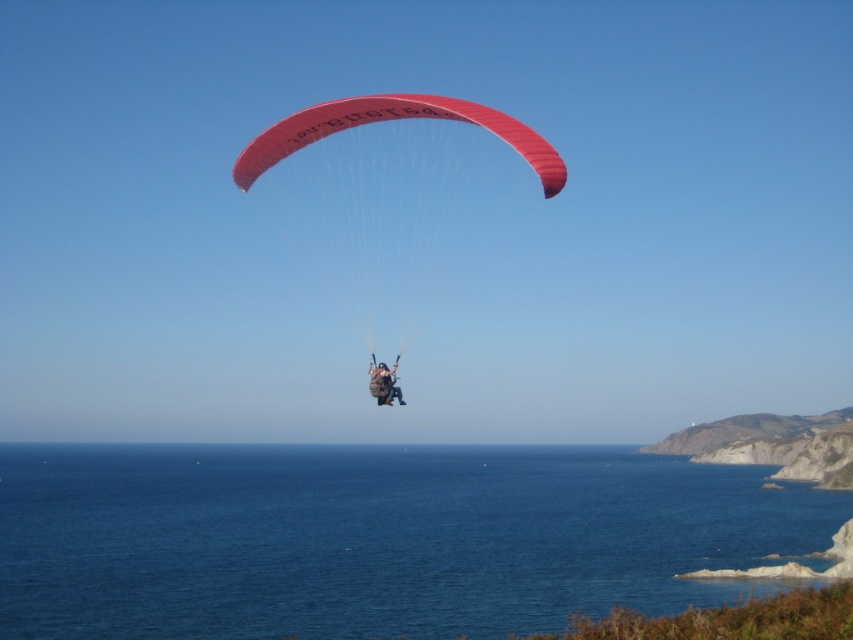
Question: Which of these objects is positioned farthest from the matte red parachute at center?

Choices:
 (A) blue liquid water at center
 (B) camouflage fabric paraglider at center

Answer: (B)

Question: Does matte red parachute at center have a greater width compared to camouflage fabric paraglider at center?

Choices:
 (A) no
 (B) yes

Answer: (B)

Question: Where is matte red parachute at center located in relation to camouflage fabric paraglider at center in the image?

Choices:
 (A) left
 (B) right

Answer: (A)

Question: Considering the real-world distances, which object is farthest from the camouflage fabric paraglider at center?

Choices:
 (A) blue liquid water at center
 (B) matte red parachute at center

Answer: (A)

Question: Which of the following is the farthest from the observer?

Choices:
 (A) blue liquid water at center
 (B) matte red parachute at center

Answer: (A)

Question: Where is matte red parachute at center located in relation to camouflage fabric paraglider at center in the image?

Choices:
 (A) below
 (B) above

Answer: (B)